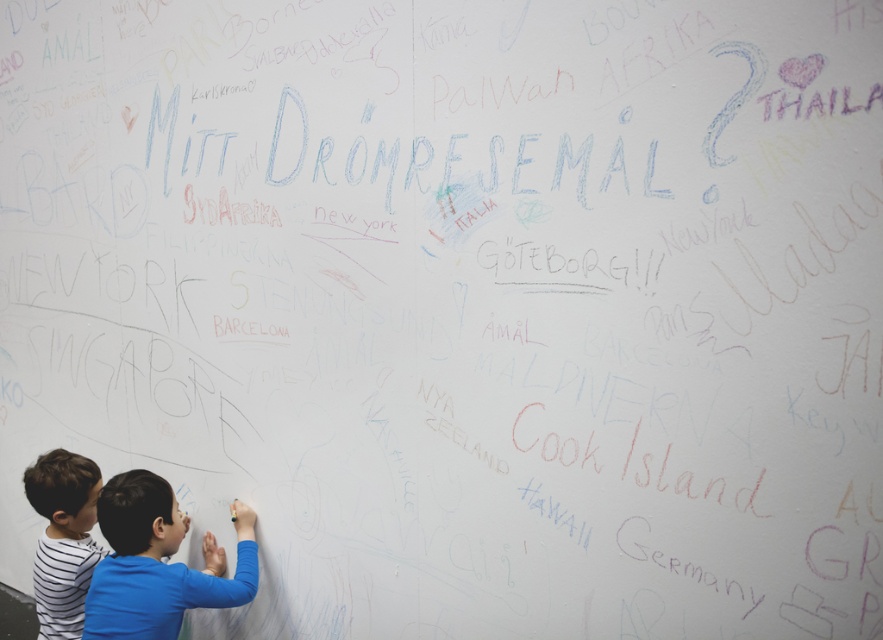
You are a photographer standing in front of the large white wall with colorful writings. You want to take a photo of both the blue shirt at lower left and the striped cotton shirt at lower left. Can you see both shirts in the photo if you take it from your current position?

The blue shirt at lower left is in front of the striped cotton shirt at lower left, so the blue shirt may block the view of the striped cotton shirt at lower left in the photo.

You are standing at the center of the wall and want to find the child in the blue shirt at lower left. According to the coordinates, where should you look relative to the center of the wall?

The blue shirt at lower left is located at coordinates point 0.881 on the x axis and 0.179 on the y axis, so you should look to the right and down from the center of the wall since the x value is greater than 0.5 and the y value is less than 0.5.

You are a photographer standing 10 feet away from the wall with two children in front of you. You want to capture both the blue shirt at lower left and the striped cotton shirt at lower left in the same frame. Given that your camera has a maximum zoom of 10x, can you fit both shirts into the frame without moving closer?

The distance between the blue shirt at lower left and the striped cotton shirt at lower left is 12.66 inches. Since the photographer is 10 feet away, the camera should be able to capture both shirts within the frame without needing to zoom beyond 10x, as the separation between them is relatively small compared to the camera sensor and lens capabilities at that distance.